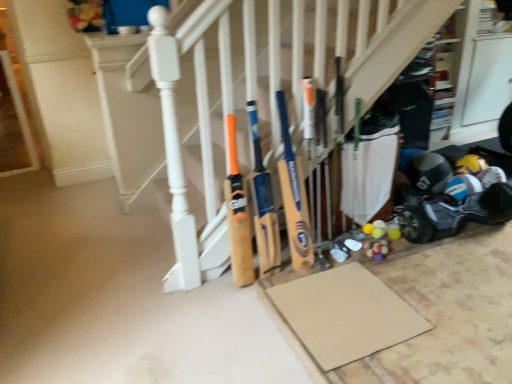
This screenshot has height=384, width=512. I want to click on free location in front of wooden bat at center, the 1th baseball bat from the left, so click(x=237, y=306).